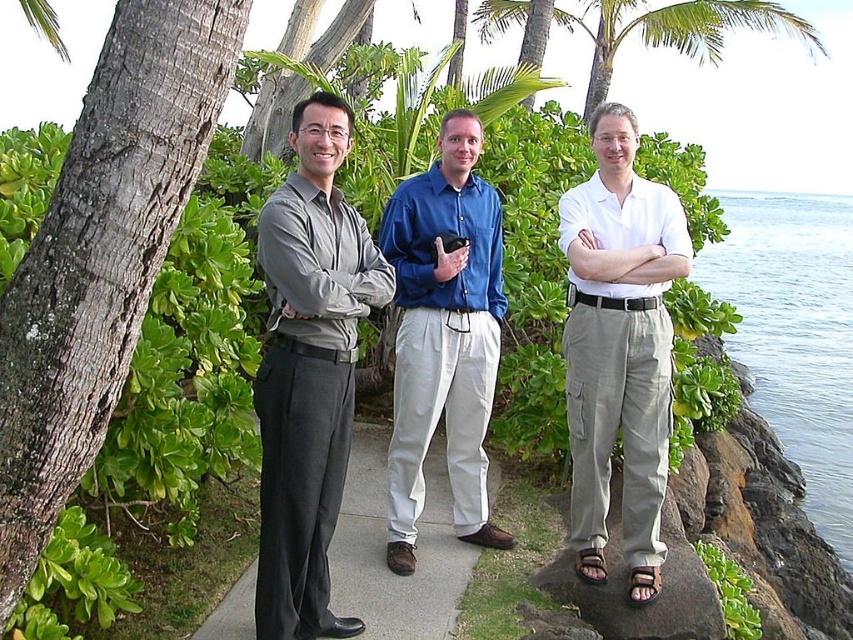
Between black smooth pavement at center and green leafy palm tree at upper center, which one is positioned lower?

black smooth pavement at center is lower down.

Is point (355, 515) more distant than point (584, 19)?

No.

Which is behind, point (407, 592) or point (672, 49)?

Point (672, 49)

Find the location of a particular element. black smooth pavement at center is located at coordinates (384, 547).

Identify the location of matte gray shirt at center. (309, 371).

Can you confirm if matte gray shirt at center is bigger than blue liquid water at right?

Incorrect, matte gray shirt at center is not larger than blue liquid water at right.

Find the location of a particular element. Image resolution: width=853 pixels, height=640 pixels. matte gray shirt at center is located at coordinates (309, 371).

Locate an element on the screen. The height and width of the screenshot is (640, 853). matte gray shirt at center is located at coordinates (309, 371).

Identify the location of gray bark tree trunk at left. (102, 256).

What do you see at coordinates (102, 256) in the screenshot? I see `gray bark tree trunk at left` at bounding box center [102, 256].

Locate an element on the screen. This screenshot has height=640, width=853. gray bark tree trunk at left is located at coordinates (102, 256).